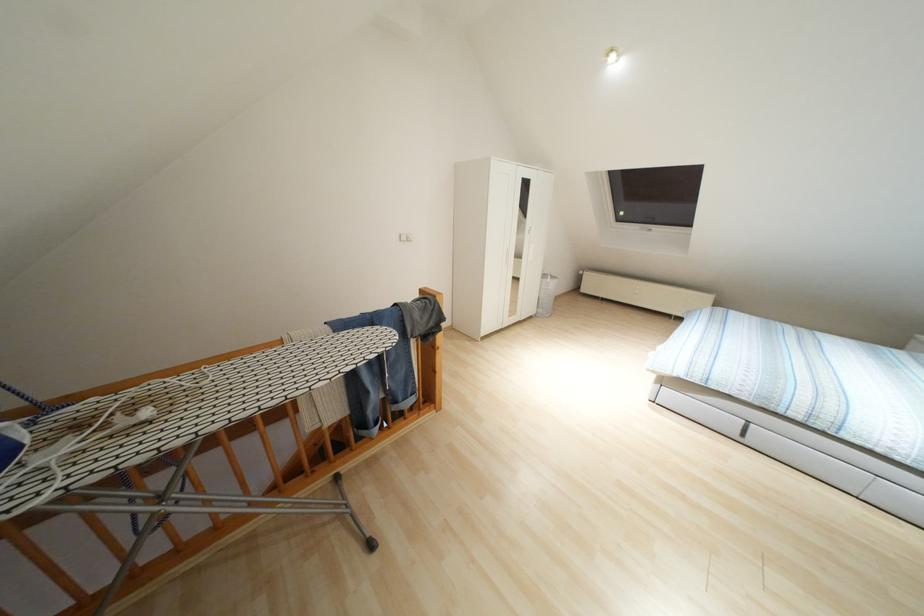
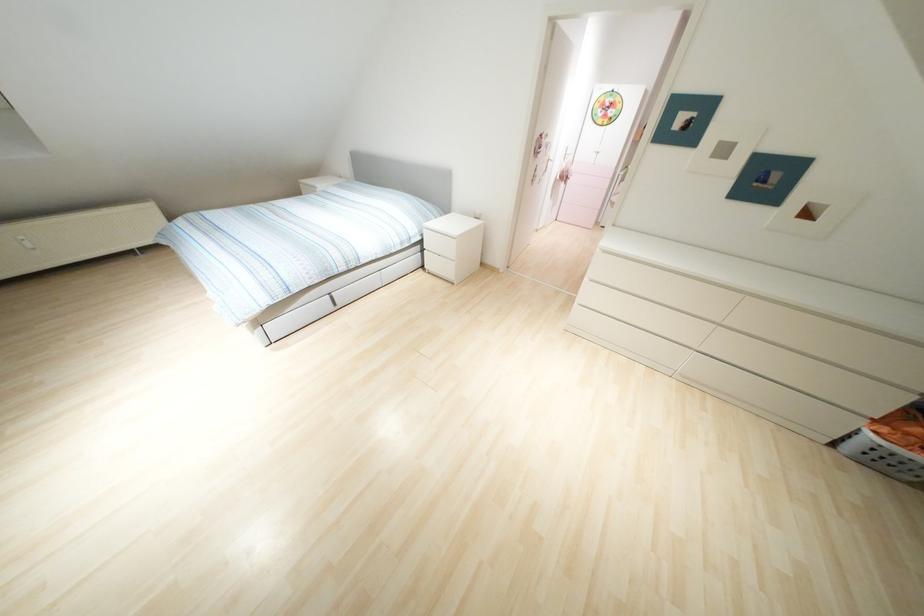
Based on the continuous images, in which direction is the camera rotating?

The rotation direction of the camera is right-down.